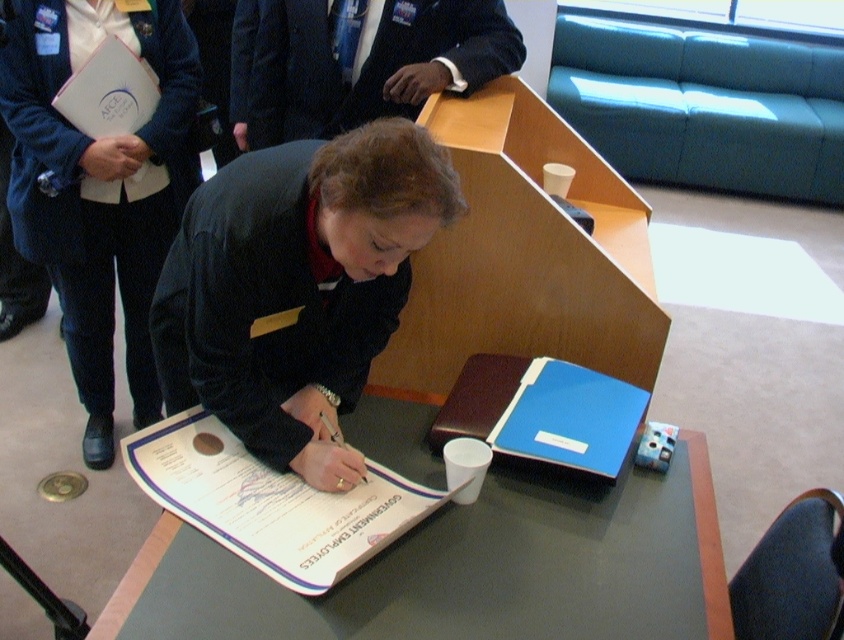
Does dark blue suit at center have a lesser height compared to white paper at center?

No.

Can you confirm if dark blue suit at center is positioned to the left of white paper at center?

In fact, dark blue suit at center is to the right of white paper at center.

Identify the location of dark blue suit at center. (296, 285).

Between smooth gray table at center and dark blue suit at upper center, which one has less height?

With less height is smooth gray table at center.

Can you confirm if smooth gray table at center is wider than dark blue suit at upper center?

Yes.

Identify the location of smooth gray table at center. (468, 570).

You are a GUI agent. You are given a task and a screenshot of the screen. Output one action in this format:
    pyautogui.click(x=<x>, y=<y>)
    Task: Click on the dark blue suit at center
    This screenshot has width=844, height=640.
    Given the screenshot: What is the action you would take?
    pyautogui.click(x=296, y=285)

Does dark blue suit at center have a smaller size compared to blue plastic clipboard at center?

No.

The width and height of the screenshot is (844, 640). Find the location of `dark blue suit at center`. dark blue suit at center is located at coordinates (296, 285).